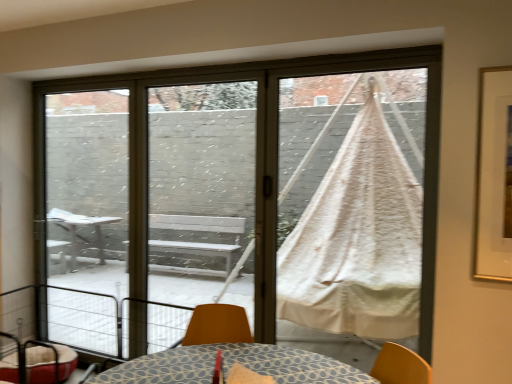
Question: Which is correct: transparent glass screen door at center, positioned as the 2th screen door in left-to-right order, is inside white fabric hammock at center, or outside of it?

Choices:
 (A) outside
 (B) inside

Answer: (B)

Question: Considering the relative positions of transparent glass screen door at center, positioned as the 2th screen door in left-to-right order, and white fabric hammock at center in the image provided, is transparent glass screen door at center, positioned as the 2th screen door in left-to-right order, to the left or to the right of white fabric hammock at center?

Choices:
 (A) left
 (B) right

Answer: (A)

Question: Based on their relative distances, which object is farther from the transparent glass screen door at center, positioned as the 1th screen door in right-to-left order?

Choices:
 (A) velvet red pet bed at lower left
 (B) metallic wire balcony at lower left
 (C) white fabric hammock at center
 (D) white cotton hammock at right
 (E) transparent glass screen door at left, acting as the first screen door starting from the left

Answer: (A)

Question: Estimate the real-world distances between objects in this image. Which object is closer to the velvet red pet bed at lower left?

Choices:
 (A) white fabric hammock at center
 (B) metallic wire balcony at lower left
 (C) white cotton hammock at right
 (D) transparent glass screen door at center, positioned as the 2th screen door in left-to-right order
 (E) transparent glass screen door at left, acting as the first screen door starting from the left

Answer: (B)